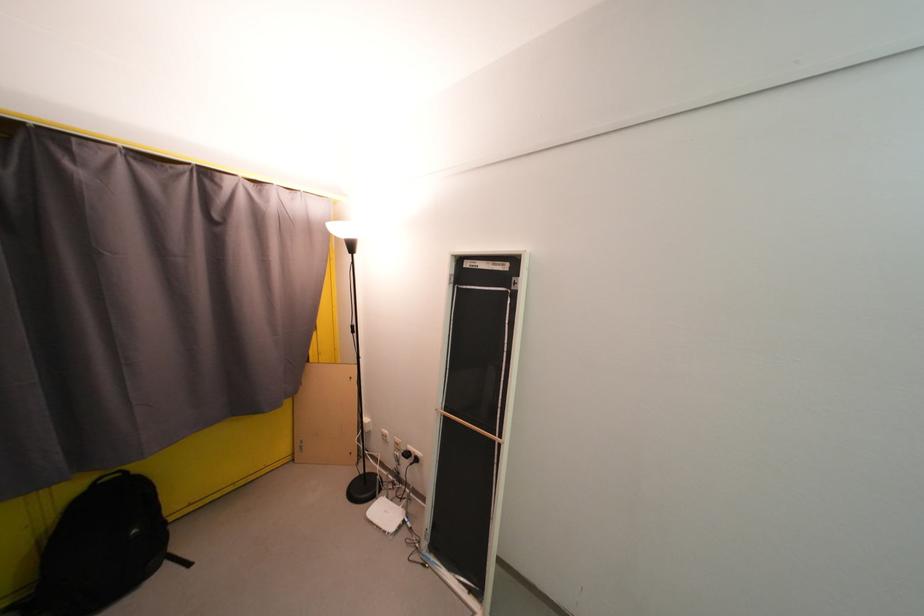
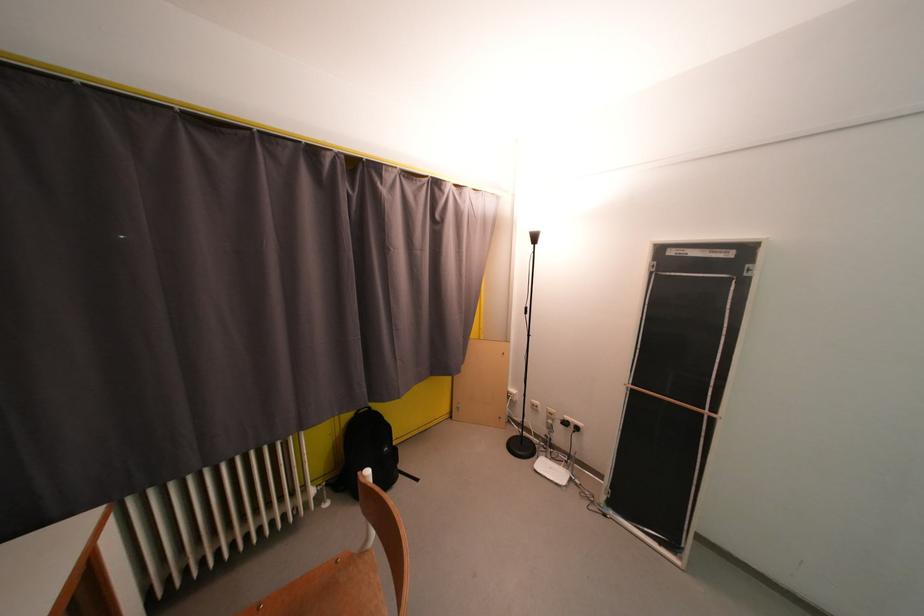
Find the pixel in the second image that matches pixel 134 476 in the first image.

(378, 411)